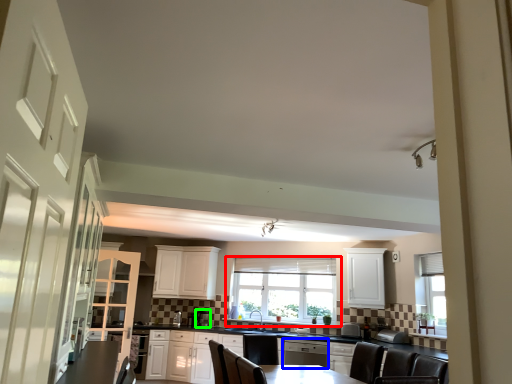
Question: Which object is positioned farthest from window (highlighted by a red box)? Select from dish washer (highlighted by a blue box) and appliance (highlighted by a green box).

Choices:
 (A) dish washer
 (B) appliance

Answer: (A)